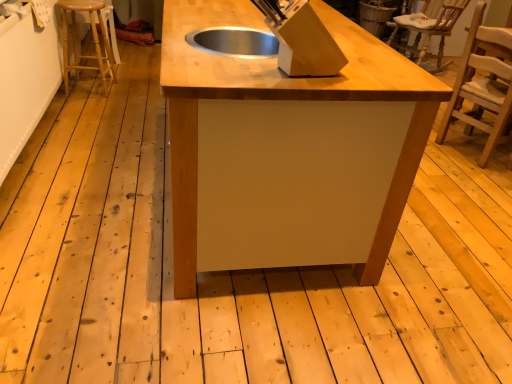
Locate an element on the screen. vacant space that is to the left of matte wood table at center is located at coordinates (97, 158).